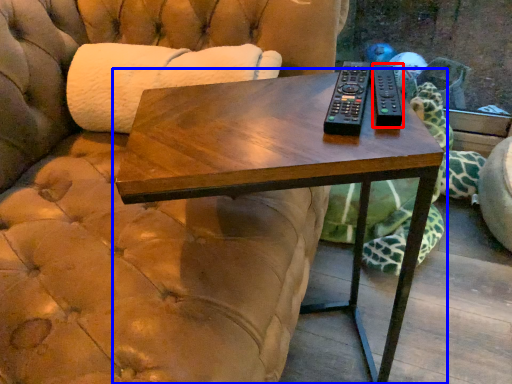
Question: Which of the following is the farthest to the observer, remote (highlighted by a red box) or table (highlighted by a blue box)?

Choices:
 (A) remote
 (B) table

Answer: (A)